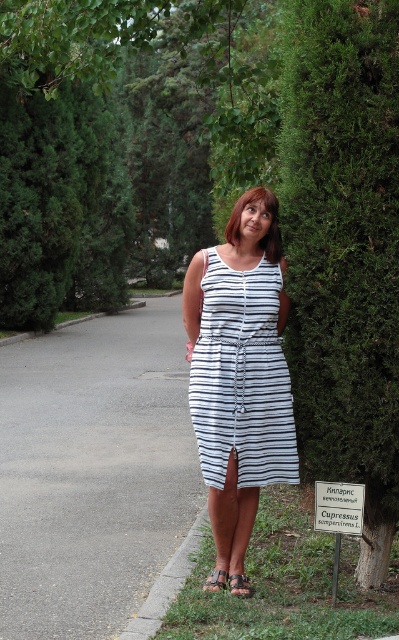
Question: Which object is positioned closest to the brown leather sandal at lower center?

Choices:
 (A) green textured hedge at center
 (B) gray concrete curb at lower left

Answer: (B)

Question: Among these points, which one is farthest from the camera?

Choices:
 (A) (191, 528)
 (B) (239, 586)

Answer: (A)

Question: Does gray asphalt pavement at center have a larger size compared to gray concrete curb at lower left?

Choices:
 (A) yes
 (B) no

Answer: (A)

Question: Does green textured hedge at center have a smaller size compared to white striped dress at center?

Choices:
 (A) yes
 (B) no

Answer: (B)

Question: Does gray asphalt pavement at center have a larger size compared to gray concrete curb at lower left?

Choices:
 (A) no
 (B) yes

Answer: (B)

Question: Which object is closer to the camera taking this photo?

Choices:
 (A) green textured hedge at center
 (B) gray asphalt pavement at center

Answer: (A)